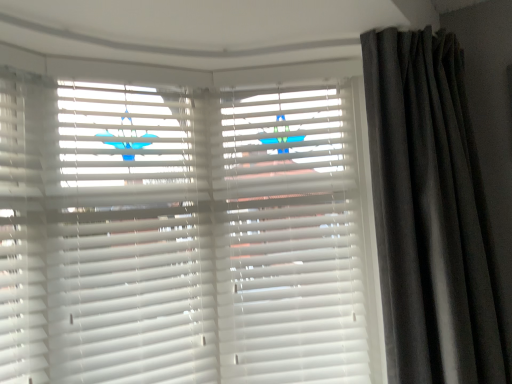
What is the approximate width of white matte blinds at center, placed as the 2th shutter when sorted from right to left?

The width of white matte blinds at center, placed as the 2th shutter when sorted from right to left, is 27.62 centimeters.

This screenshot has height=384, width=512. Describe the element at coordinates (129, 238) in the screenshot. I see `white matte blinds at center, the first shutter positioned from the left` at that location.

At what (x,y) coordinates should I click in order to perform the action: click on white matte shutter at center, the first shutter when ordered from right to left. Please return your answer as a coordinate pair (x, y). Image resolution: width=512 pixels, height=384 pixels. Looking at the image, I should click on (297, 236).

What do you see at coordinates (297, 236) in the screenshot? I see `white matte shutter at center, positioned as the second shutter in left-to-right order` at bounding box center [297, 236].

You are a GUI agent. You are given a task and a screenshot of the screen. Output one action in this format:
    pyautogui.click(x=<x>, y=<y>)
    Task: Click on the white matte blinds at center, placed as the 2th shutter when sorted from right to left
    The image size is (512, 384).
    Given the screenshot: What is the action you would take?
    pyautogui.click(x=129, y=238)

Considering the relative sizes of dark grey velvet curtain at right and white matte shutter at center, the first shutter when ordered from right to left, in the image provided, is dark grey velvet curtain at right wider than white matte shutter at center, the first shutter when ordered from right to left,?

Yes, dark grey velvet curtain at right is wider than white matte shutter at center, the first shutter when ordered from right to left.

From a real-world perspective, is dark grey velvet curtain at right under white matte shutter at center, the first shutter when ordered from right to left?

No, from a real-world perspective, dark grey velvet curtain at right is not below white matte shutter at center, the first shutter when ordered from right to left.

This screenshot has height=384, width=512. In order to click on shutter that is the 1st one when counting leftward from the dark grey velvet curtain at right in this screenshot , I will do `click(297, 236)`.

Who is more distant, dark grey velvet curtain at right or white matte shutter at center, the first shutter when ordered from right to left?

Positioned behind is white matte shutter at center, the first shutter when ordered from right to left.

Can you see white matte blinds at center, placed as the 2th shutter when sorted from right to left, touching white matte shutter at center, positioned as the second shutter in left-to-right order?

No, white matte blinds at center, placed as the 2th shutter when sorted from right to left, is not in contact with white matte shutter at center, positioned as the second shutter in left-to-right order.

From the image's perspective, is white matte blinds at center, placed as the 2th shutter when sorted from right to left, below white matte shutter at center, the first shutter when ordered from right to left?

Incorrect, from the image's perspective, white matte blinds at center, placed as the 2th shutter when sorted from right to left, is higher than white matte shutter at center, the first shutter when ordered from right to left.

Can you confirm if white matte blinds at center, the first shutter positioned from the left, is smaller than white matte shutter at center, the first shutter when ordered from right to left?

Indeed, white matte blinds at center, the first shutter positioned from the left, has a smaller size compared to white matte shutter at center, the first shutter when ordered from right to left.

From a real-world perspective, is white matte blinds at center, the first shutter positioned from the left, located higher than white matte shutter at center, the first shutter when ordered from right to left?

Yes.

Which object is positioned more to the left, dark grey velvet curtain at right or white matte blinds at center, placed as the 2th shutter when sorted from right to left?

white matte blinds at center, placed as the 2th shutter when sorted from right to left, is more to the left.

Is dark grey velvet curtain at right located outside white matte blinds at center, the first shutter positioned from the left?

Yes, dark grey velvet curtain at right is located beyond the bounds of white matte blinds at center, the first shutter positioned from the left.

From a real-world perspective, is dark grey velvet curtain at right on top of white matte blinds at center, the first shutter positioned from the left?

No.

Considering the sizes of objects white matte shutter at center, positioned as the second shutter in left-to-right order, and dark grey velvet curtain at right in the image provided, who is thinner, white matte shutter at center, positioned as the second shutter in left-to-right order, or dark grey velvet curtain at right?

With smaller width is white matte shutter at center, positioned as the second shutter in left-to-right order.

From the image's perspective, is white matte shutter at center, positioned as the second shutter in left-to-right order, located above or below dark grey velvet curtain at right?

From the image's perspective, white matte shutter at center, positioned as the second shutter in left-to-right order, appears below dark grey velvet curtain at right.

Between white matte shutter at center, positioned as the second shutter in left-to-right order, and dark grey velvet curtain at right, which one appears on the left side from the viewer's perspective?

Positioned to the left is white matte shutter at center, positioned as the second shutter in left-to-right order.

Does white matte shutter at center, positioned as the second shutter in left-to-right order, lie behind dark grey velvet curtain at right?

Yes, white matte shutter at center, positioned as the second shutter in left-to-right order, is further from the viewer.

Between white matte blinds at center, placed as the 2th shutter when sorted from right to left, and dark grey velvet curtain at right, which one has less height?

white matte blinds at center, placed as the 2th shutter when sorted from right to left, is shorter.

You are a GUI agent. You are given a task and a screenshot of the screen. Output one action in this format:
    pyautogui.click(x=<x>, y=<y>)
    Task: Click on the shutter above the dark grey velvet curtain at right (from a real-world perspective)
    The height and width of the screenshot is (384, 512).
    Given the screenshot: What is the action you would take?
    pyautogui.click(x=129, y=238)

Is white matte blinds at center, placed as the 2th shutter when sorted from right to left, positioned beyond the bounds of dark grey velvet curtain at right?

Absolutely, white matte blinds at center, placed as the 2th shutter when sorted from right to left, is external to dark grey velvet curtain at right.

Can you tell me how much white matte blinds at center, placed as the 2th shutter when sorted from right to left, and dark grey velvet curtain at right differ in facing direction?

The facing directions of white matte blinds at center, placed as the 2th shutter when sorted from right to left, and dark grey velvet curtain at right are 27.8 degrees apart.

Is white matte shutter at center, the first shutter when ordered from right to left, at the left side of white matte blinds at center, placed as the 2th shutter when sorted from right to left?

In fact, white matte shutter at center, the first shutter when ordered from right to left, is to the right of white matte blinds at center, placed as the 2th shutter when sorted from right to left.

From the image's perspective, would you say white matte shutter at center, positioned as the second shutter in left-to-right order, is positioned over white matte blinds at center, the first shutter positioned from the left?

Actually, white matte shutter at center, positioned as the second shutter in left-to-right order, appears below white matte blinds at center, the first shutter positioned from the left, in the image.

Is white matte shutter at center, the first shutter when ordered from right to left, wider or thinner than white matte blinds at center, placed as the 2th shutter when sorted from right to left?

Clearly, white matte shutter at center, the first shutter when ordered from right to left, has more width compared to white matte blinds at center, placed as the 2th shutter when sorted from right to left.

Is point (271, 140) closer or farther from the camera than point (123, 205)?

Clearly, point (271, 140) is more distant from the camera than point (123, 205).

Which shutter is the 2nd one when counting from the back of the dark grey velvet curtain at right? Please provide its 2D coordinates.

[(297, 236)]

This screenshot has width=512, height=384. Find the location of `shutter on the left of the white matte shutter at center, the first shutter when ordered from right to left`. shutter on the left of the white matte shutter at center, the first shutter when ordered from right to left is located at coordinates (129, 238).

Which object lies nearer to the anchor point dark grey velvet curtain at right, white matte blinds at center, the first shutter positioned from the left, or white matte shutter at center, positioned as the second shutter in left-to-right order?

The object closer to dark grey velvet curtain at right is white matte shutter at center, positioned as the second shutter in left-to-right order.

Based on their spatial positions, is white matte shutter at center, the first shutter when ordered from right to left, or white matte blinds at center, the first shutter positioned from the left, closer to dark grey velvet curtain at right?

Based on the image, white matte shutter at center, the first shutter when ordered from right to left, appears to be nearer to dark grey velvet curtain at right.

From the image, which object appears to be farther from white matte blinds at center, the first shutter positioned from the left, dark grey velvet curtain at right or white matte shutter at center, positioned as the second shutter in left-to-right order?

The object further to white matte blinds at center, the first shutter positioned from the left, is dark grey velvet curtain at right.

Estimate the real-world distances between objects in this image. Which object is closer to white matte blinds at center, the first shutter positioned from the left, white matte shutter at center, the first shutter when ordered from right to left, or dark grey velvet curtain at right?

white matte shutter at center, the first shutter when ordered from right to left, is positioned closer to the anchor white matte blinds at center, the first shutter positioned from the left.

From the image, which object appears to be nearer to white matte shutter at center, the first shutter when ordered from right to left, dark grey velvet curtain at right or white matte blinds at center, placed as the 2th shutter when sorted from right to left?

The object closer to white matte shutter at center, the first shutter when ordered from right to left, is dark grey velvet curtain at right.

Considering their positions, is white matte blinds at center, placed as the 2th shutter when sorted from right to left, positioned further to white matte shutter at center, the first shutter when ordered from right to left, than dark grey velvet curtain at right?

white matte blinds at center, placed as the 2th shutter when sorted from right to left, is further to white matte shutter at center, the first shutter when ordered from right to left.

Where is `shutter between white matte blinds at center, placed as the 2th shutter when sorted from right to left, and dark grey velvet curtain at right, in the horizontal direction`? The image size is (512, 384). shutter between white matte blinds at center, placed as the 2th shutter when sorted from right to left, and dark grey velvet curtain at right, in the horizontal direction is located at coordinates (297, 236).